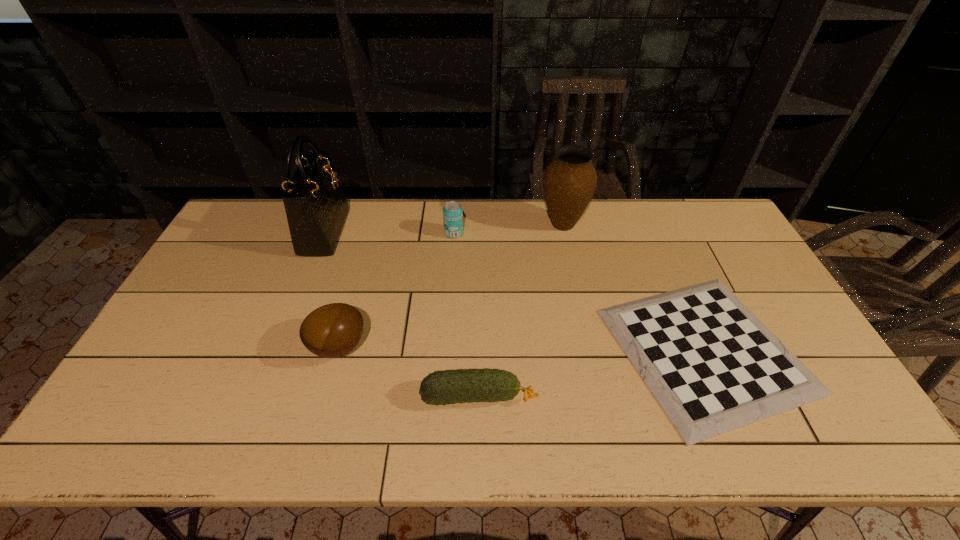
Find the location of `the tallest object`. the tallest object is located at coordinates 316,208.

Locate an element on the screen. the leftmost object is located at coordinates (316, 208).

Locate an element on the screen. The height and width of the screenshot is (540, 960). urn is located at coordinates (569, 182).

Locate an element on the screen. beer can is located at coordinates (452, 211).

The width and height of the screenshot is (960, 540). What are the coordinates of `bowl` in the screenshot? It's located at (331, 331).

Find the location of a particular element. The height and width of the screenshot is (540, 960). cucumber is located at coordinates (445, 387).

Identify the location of the shortest object. Image resolution: width=960 pixels, height=540 pixels. (712, 365).

Identify the location of vacant region located at the front of the tallest object with visible charms. (427, 232).

Find the location of `vacant space located 0.330m on the left of the urn`. vacant space located 0.330m on the left of the urn is located at coordinates (444, 224).

I want to click on vacant point located on the right of the third tallest object, so tap(510, 233).